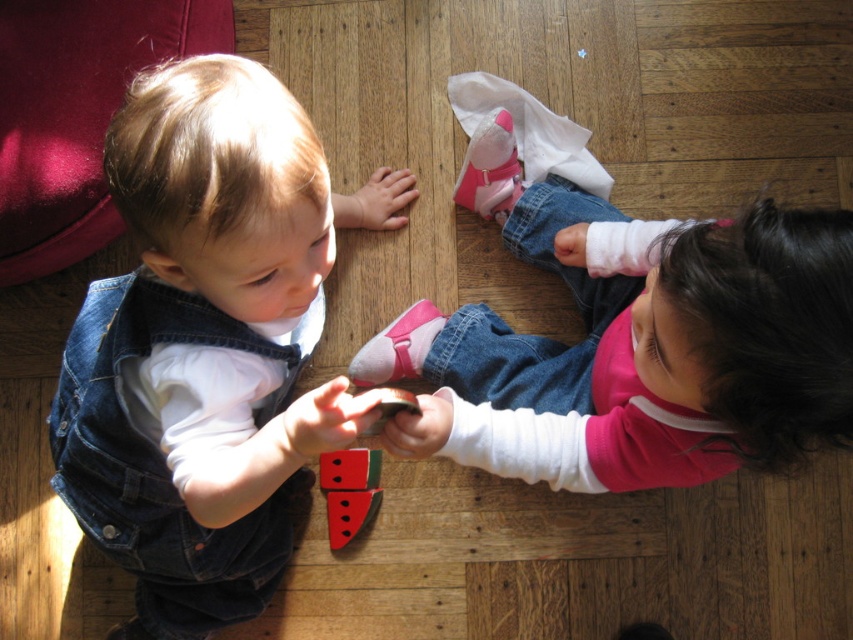
Does denim overalls at left appear over pink fabric socks at lower center?

Actually, denim overalls at left is below pink fabric socks at lower center.

Identify the location of denim overalls at left. (206, 340).

Which is above, denim overalls at left or watermelon-patterned wood block at center?

denim overalls at left

Who is positioned more to the left, denim overalls at left or watermelon-patterned wood block at center?

Positioned to the left is denim overalls at left.

Locate an element on the screen. This screenshot has height=640, width=853. denim overalls at left is located at coordinates (206, 340).

Does pink fabric socks at lower center have a lesser width compared to watermelon-patterned wood block at center?

No.

Does point (596, 316) come farther from viewer compared to point (376, 472)?

No, (596, 316) is in front of (376, 472).

Does point (508, 451) come in front of point (325, 460)?

Yes, it is in front of point (325, 460).

I want to click on pink fabric socks at lower center, so click(x=640, y=348).